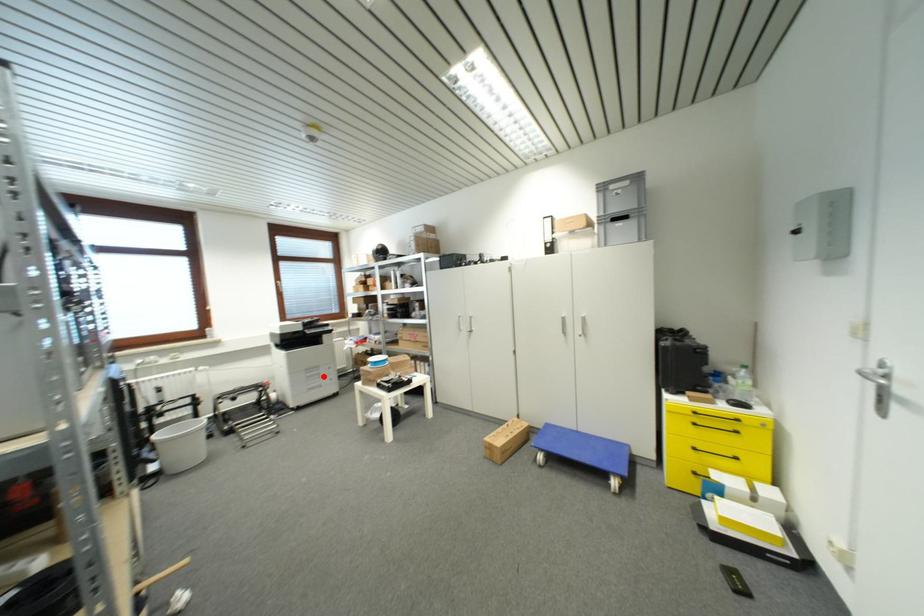
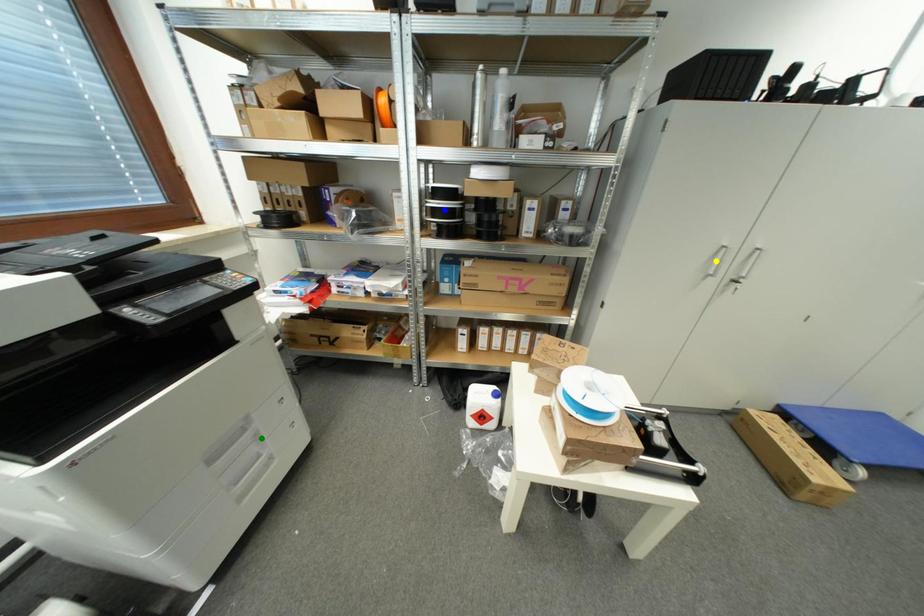
Question: I am providing you with two images of the same scene from different viewpoints. A red point is marked on the first image. You are given multiple points on the second image. Which mark in image 2 goes with the point in image 1?

Choices:
 (A) blue point
 (B) green point
 (C) yellow point

Answer: (B)